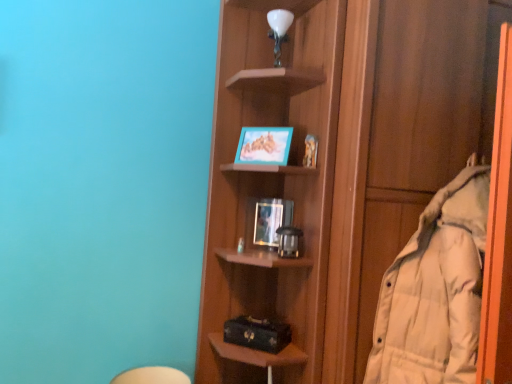
Question: Can you confirm if matte plastic picture frame at middle, marked as the first picture frame in a bottom-to-top arrangement, is wider than white down-filled coat at right?

Choices:
 (A) yes
 (B) no

Answer: (B)

Question: Considering the relative positions of matte plastic picture frame at middle, the 2th picture frame from the top, and white down-filled coat at right in the image provided, is matte plastic picture frame at middle, the 2th picture frame from the top, to the left of white down-filled coat at right from the viewer's perspective?

Choices:
 (A) no
 (B) yes

Answer: (B)

Question: Is matte plastic picture frame at middle, the 2th picture frame from the top, directly adjacent to white down-filled coat at right?

Choices:
 (A) yes
 (B) no

Answer: (B)

Question: From the image's perspective, does matte plastic picture frame at middle, marked as the first picture frame in a bottom-to-top arrangement, appear lower than white down-filled coat at right?

Choices:
 (A) no
 (B) yes

Answer: (A)

Question: Is matte plastic picture frame at middle, the 2th picture frame from the top, positioned beyond the bounds of white down-filled coat at right?

Choices:
 (A) yes
 (B) no

Answer: (A)

Question: In terms of size, does white down-filled coat at right appear bigger or smaller than wooden shelf at center?

Choices:
 (A) small
 (B) big

Answer: (A)

Question: Looking at their shapes, would you say white down-filled coat at right is wider or thinner than wooden shelf at center?

Choices:
 (A) thin
 (B) wide

Answer: (A)

Question: Is white down-filled coat at right situated inside wooden shelf at center or outside?

Choices:
 (A) outside
 (B) inside

Answer: (A)

Question: Considering their positions, is white down-filled coat at right located in front of or behind wooden shelf at center?

Choices:
 (A) behind
 (B) front

Answer: (B)

Question: Based on their sizes in the image, would you say matte plastic picture frame at middle, the 2th picture frame from the top, is bigger or smaller than wooden shelf at center?

Choices:
 (A) small
 (B) big

Answer: (A)

Question: Considering their positions, is matte plastic picture frame at middle, the 2th picture frame from the top, located in front of or behind wooden shelf at center?

Choices:
 (A) behind
 (B) front

Answer: (A)

Question: In the image, is matte plastic picture frame at middle, marked as the first picture frame in a bottom-to-top arrangement, on the left side or the right side of wooden shelf at center?

Choices:
 (A) right
 (B) left

Answer: (B)

Question: Which is correct: matte plastic picture frame at middle, the 2th picture frame from the top, is inside wooden shelf at center, or outside of it?

Choices:
 (A) outside
 (B) inside

Answer: (A)

Question: From a real-world perspective, is teal matte picture frame at upper center, which ranks as the first picture frame in top-to-bottom order, positioned above or below wooden shelf at center?

Choices:
 (A) above
 (B) below

Answer: (A)

Question: From the image's perspective, is teal matte picture frame at upper center, which ranks as the first picture frame in top-to-bottom order, positioned above or below wooden shelf at center?

Choices:
 (A) above
 (B) below

Answer: (A)